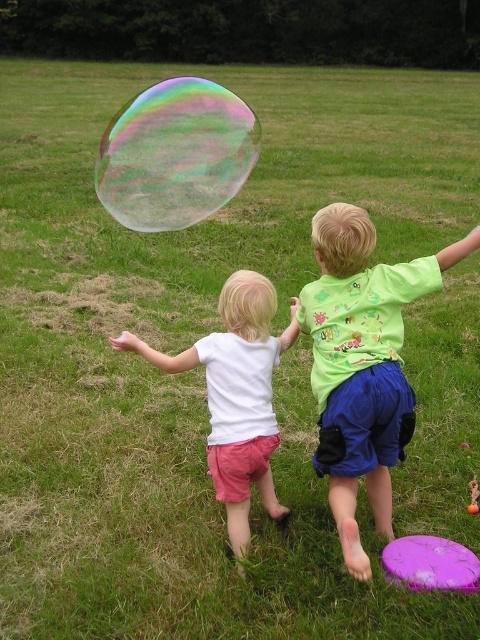
Is point (206, 200) farther from viewer compared to point (402, 563)?

Yes, it is.

Looking at this image, which is more to the right, transparent iridescent bubble at upper center or purple matte frisbee at lower right?

purple matte frisbee at lower right

At what (x,y) coordinates should I click in order to perform the action: click on transparent iridescent bubble at upper center. Please return your answer as a coordinate pair (x, y). This screenshot has width=480, height=640. Looking at the image, I should click on (175, 154).

Does green cotton shirt at center have a lesser height compared to white matte shirt at center?

Incorrect, green cotton shirt at center's height does not fall short of white matte shirt at center's.

Is point (327, 451) more distant than point (233, 365)?

No, it is in front of (233, 365).

I want to click on green cotton shirt at center, so click(362, 364).

Between white matte shirt at center and purple matte frisbee at lower right, which one appears on the right side from the viewer's perspective?

From the viewer's perspective, purple matte frisbee at lower right appears more on the right side.

Between white matte shirt at center and purple matte frisbee at lower right, which one appears on the left side from the viewer's perspective?

white matte shirt at center is more to the left.

Does point (247, 529) lie in front of point (436, 582)?

No, (247, 529) is behind (436, 582).

Locate an element on the screen. white matte shirt at center is located at coordinates (236, 394).